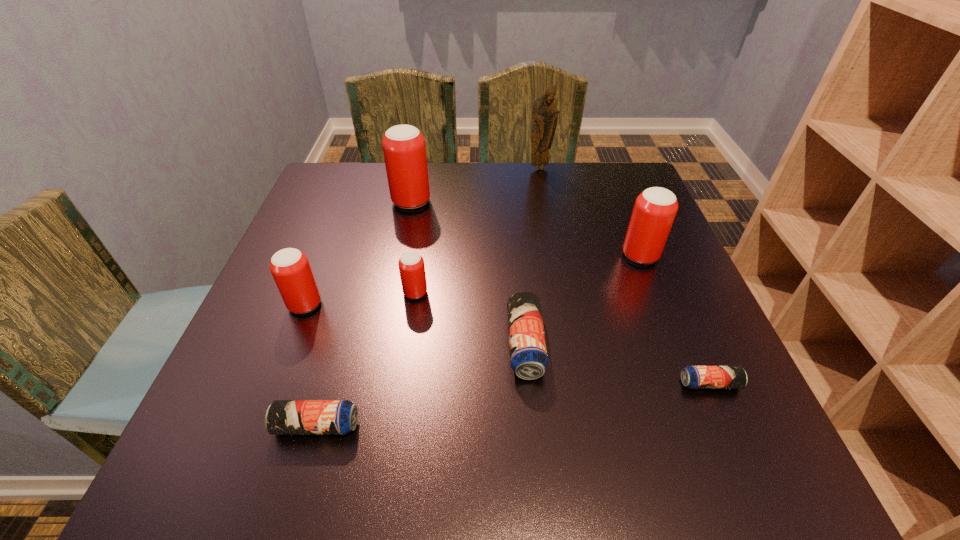
Locate an element on the screen. This screenshot has height=540, width=960. vacant space at the right edge of the desktop is located at coordinates (619, 226).

What are the coordinates of `free space at the far left corner` in the screenshot? It's located at [x=311, y=198].

Locate an element on the screen. The width and height of the screenshot is (960, 540). vacant point at the near left corner is located at coordinates (281, 443).

At what (x,y) coordinates should I click in order to perform the action: click on free region at the far right corner of the desktop. Please return your answer as a coordinate pair (x, y). Looking at the image, I should click on (639, 181).

This screenshot has width=960, height=540. Find the location of `vacant area between the seventh nearest object and the smallest blue beer can`. vacant area between the seventh nearest object and the smallest blue beer can is located at coordinates (561, 293).

At what (x,y) coordinates should I click in order to perform the action: click on unoccupied position between the second farthest red beer can and the farthest red beer can. Please return your answer as a coordinate pair (x, y). Looking at the image, I should click on (526, 229).

Locate an element on the screen. This screenshot has width=960, height=540. empty location between the leftmost red beer can and the biggest red beer can is located at coordinates (358, 253).

Locate an element on the screen. unoccupied area between the farthest beer can and the third tallest beer can is located at coordinates (358, 253).

Where is `free spot between the fifth beer can from left to right and the second tallest beer can`? free spot between the fifth beer can from left to right and the second tallest beer can is located at coordinates (583, 300).

Locate an element on the screen. This screenshot has width=960, height=540. vacant space that's between the leftmost blue beer can and the second farthest red beer can is located at coordinates (478, 341).